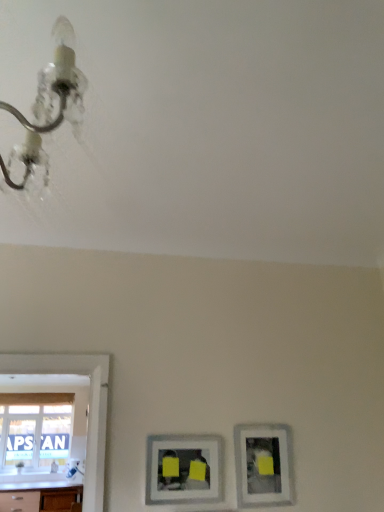
Question: Would you say matte silver picture frame at lower center, the second picture frame positioned from the right, is inside or outside matte silver picture frame at lower right, the second picture frame positioned from the left?

Choices:
 (A) inside
 (B) outside

Answer: (B)

Question: Looking at their shapes, would you say matte silver picture frame at lower center, the second picture frame positioned from the right, is wider or thinner than matte silver picture frame at lower right, which is counted as the 1th picture frame, starting from the right?

Choices:
 (A) wide
 (B) thin

Answer: (B)

Question: Which object is positioned closest to the metallic chandelier at upper left?

Choices:
 (A) matte silver picture frame at lower center, the second picture frame positioned from the right
 (B) matte silver picture frame at lower right, the second picture frame positioned from the left
 (C) white glossy countertop at lower left
 (D) transparent glass window at lower left

Answer: (A)

Question: Which of these objects is positioned farthest from the matte silver picture frame at lower center, the second picture frame positioned from the right?

Choices:
 (A) transparent glass window at lower left
 (B) matte silver picture frame at lower right, which is counted as the 1th picture frame, starting from the right
 (C) white glossy countertop at lower left
 (D) metallic chandelier at upper left

Answer: (D)